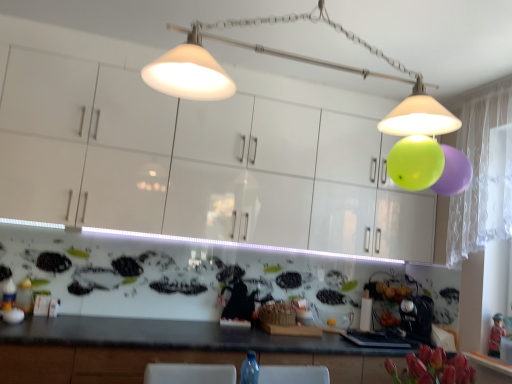
Question: Can you confirm if matte white lampshade at upper center is bigger than wooden figurine at lower right?

Choices:
 (A) yes
 (B) no

Answer: (A)

Question: Does matte white lampshade at upper center have a lesser height compared to wooden figurine at lower right?

Choices:
 (A) no
 (B) yes

Answer: (A)

Question: Does matte white lampshade at upper center appear on the right side of wooden figurine at lower right?

Choices:
 (A) yes
 (B) no

Answer: (B)

Question: Is matte white lampshade at upper center not within wooden figurine at lower right?

Choices:
 (A) yes
 (B) no

Answer: (A)

Question: Is wooden figurine at lower right surrounded by matte white lampshade at upper center?

Choices:
 (A) no
 (B) yes

Answer: (A)

Question: Looking at the image, does white glossy cabinets at upper center seem bigger or smaller compared to matte white lampshade at upper center?

Choices:
 (A) small
 (B) big

Answer: (B)

Question: In the image, is white glossy cabinets at upper center positioned in front of or behind matte white lampshade at upper center?

Choices:
 (A) front
 (B) behind

Answer: (B)

Question: Which is correct: white glossy cabinets at upper center is inside matte white lampshade at upper center, or outside of it?

Choices:
 (A) outside
 (B) inside

Answer: (A)

Question: Does point (144, 188) appear closer or farther from the camera than point (371, 46)?

Choices:
 (A) farther
 (B) closer

Answer: (A)

Question: From the image's perspective, is matte white lampshade at upper center above or below white glossy cabinets at upper center?

Choices:
 (A) above
 (B) below

Answer: (A)

Question: Is matte white lampshade at upper center taller or shorter than white glossy cabinets at upper center?

Choices:
 (A) short
 (B) tall

Answer: (A)

Question: In the image, is matte white lampshade at upper center positioned in front of or behind white glossy cabinets at upper center?

Choices:
 (A) behind
 (B) front

Answer: (B)

Question: Does point click(175, 87) appear closer or farther from the camera than point click(360, 147)?

Choices:
 (A) closer
 (B) farther

Answer: (A)

Question: From a real-world perspective, is wooden figurine at lower right physically located above or below matte white lampshade at upper center?

Choices:
 (A) above
 (B) below

Answer: (B)

Question: Would you say wooden figurine at lower right is to the left or to the right of matte white lampshade at upper center in the picture?

Choices:
 (A) left
 (B) right

Answer: (B)